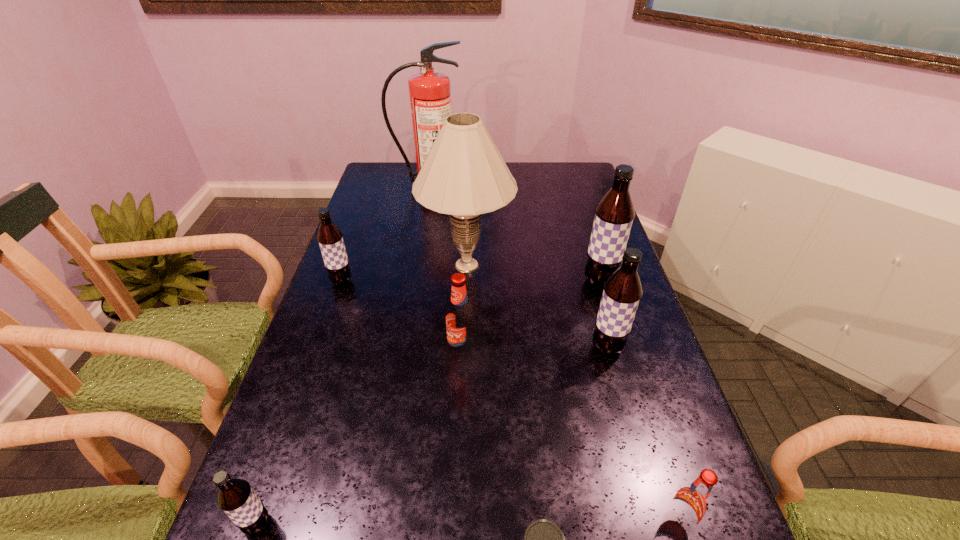
Where is `the farthest object`? the farthest object is located at coordinates (430, 98).

Image resolution: width=960 pixels, height=540 pixels. In order to click on fire extinguisher in this screenshot , I will do click(x=430, y=98).

Where is `beige lampshade`? This screenshot has height=540, width=960. beige lampshade is located at coordinates (463, 175).

The image size is (960, 540). Identify the location of the tallest root beer. (614, 214).

The image size is (960, 540). Identify the location of the biggest brown root beer. (614, 214).

The image size is (960, 540). I want to click on the second biggest brown root beer, so 622,292.

Where is `the sixth shortest object`? This screenshot has width=960, height=540. the sixth shortest object is located at coordinates (622, 292).

Where is `the second smallest brown root beer`? the second smallest brown root beer is located at coordinates (330, 238).

Identify the location of the farther red root beer. (460, 326).

This screenshot has width=960, height=540. I want to click on the bigger red root beer, so click(460, 326).